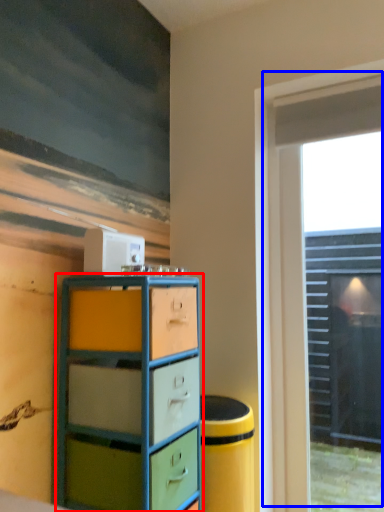
Question: Which object is further to the camera taking this photo, chest of drawers (highlighted by a red box) or window (highlighted by a blue box)?

Choices:
 (A) chest of drawers
 (B) window

Answer: (B)